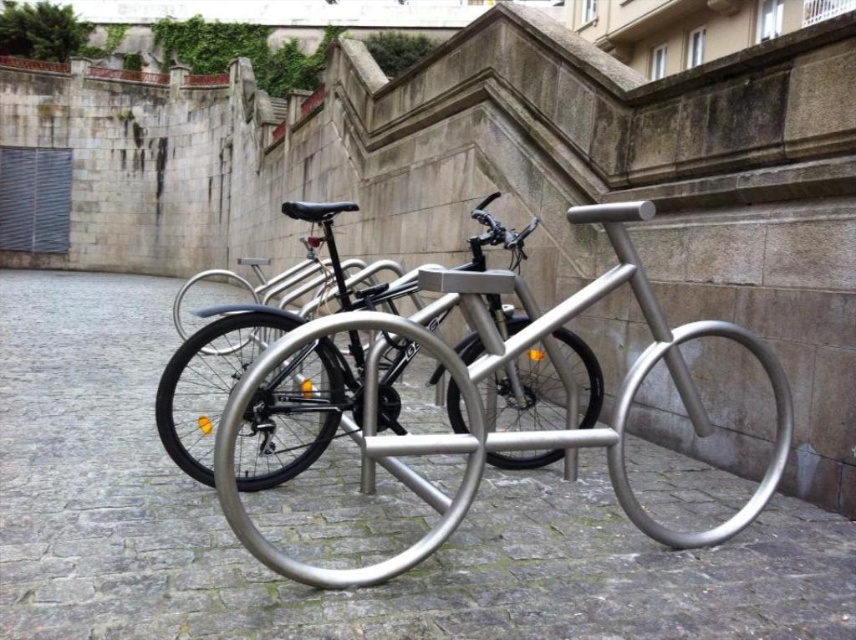
Question: Is silver metallic bike rack at center positioned before polished silver bicycle at center?

Choices:
 (A) yes
 (B) no

Answer: (A)

Question: Is silver metallic bike rack at center wider than polished silver bicycle at center?

Choices:
 (A) no
 (B) yes

Answer: (B)

Question: Among these points, which one is nearest to the camera?

Choices:
 (A) (516, 323)
 (B) (604, 609)

Answer: (B)

Question: Which object is farther from the camera taking this photo?

Choices:
 (A) silver metallic bike rack at center
 (B) polished silver bicycle at center

Answer: (B)

Question: Can you confirm if silver metallic bike rack at center is bigger than polished silver bicycle at center?

Choices:
 (A) no
 (B) yes

Answer: (A)